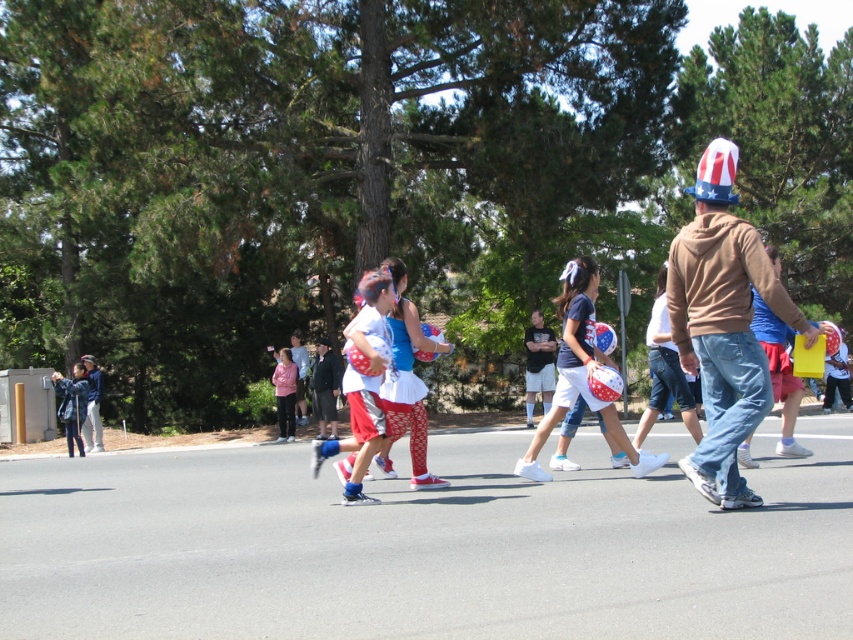
You are organizing a costume party and need to decide which item to place on a 30 cm wide shelf. The items are the brown hoodie at center and the matte red helmet at center. Which item will fit better on the shelf based on their widths?

The brown hoodie at center has a smaller width than the matte red helmet at center, so it will fit better on the 30 cm wide shelf.

You are a photographer trying to capture a photo of the brown hoodie at center and the matte red helmet at center from above. Which object would appear smaller in the photo?

The brown hoodie at center would appear smaller in the photo because it has a lesser height compared to the matte red helmet at center.